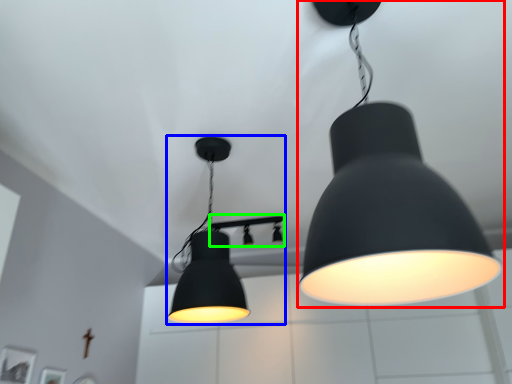
Question: Based on their relative distances, which object is farther from lamp (highlighted by a red box)? Choose from lamp (highlighted by a blue box) and lamp (highlighted by a green box).

Choices:
 (A) lamp
 (B) lamp

Answer: (B)